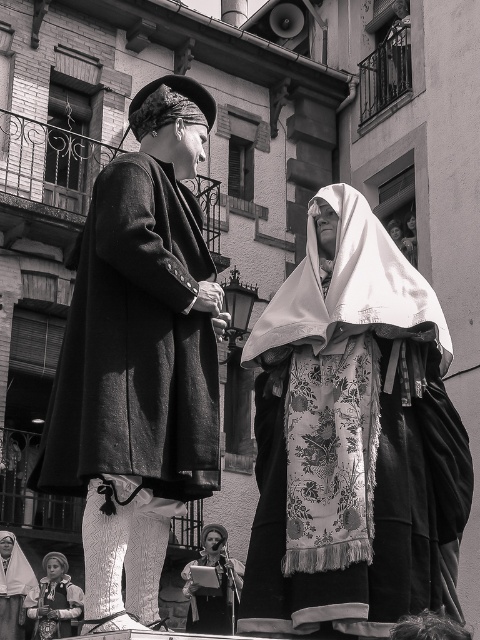
Is matte black coat at left smaller than floral fabric dress at center?

Incorrect, matte black coat at left is not smaller in size than floral fabric dress at center.

Is point (216, 460) positioned behind point (0, 564)?

No, (216, 460) is closer to viewer.

Image resolution: width=480 pixels, height=640 pixels. Find the location of `matte black coat at left`. matte black coat at left is located at coordinates (133, 381).

Is floral fabric robe at center closer to camera compared to floral fabric robe at lower left?

Yes, it is in front of floral fabric robe at lower left.

Who is positioned more to the left, floral fabric robe at center or floral fabric robe at lower left?

floral fabric robe at lower left is more to the left.

Find the location of `floral fabric robe at center`. floral fabric robe at center is located at coordinates (213, 595).

Identify the location of floral fabric robe at center. The width and height of the screenshot is (480, 640). (213, 595).

Is point (271, 616) less distant than point (4, 547)?

Yes, point (271, 616) is closer to viewer.

Who is positioned more to the left, floral fabric shawl at center or floral fabric dress at center?

From the viewer's perspective, floral fabric dress at center appears more on the left side.

Locate an element on the screen. floral fabric shawl at center is located at coordinates (352, 436).